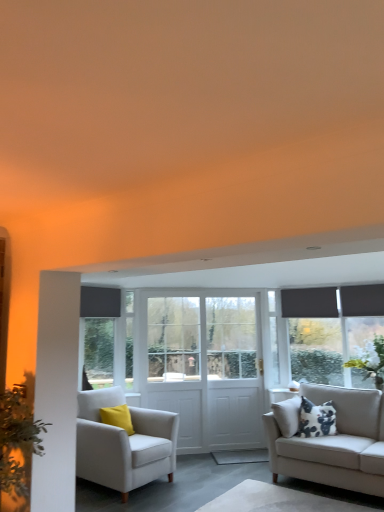
Question: Does white wooden door at center, which is the first screen door in right-to-left order, have a smaller size compared to white wooden screen door at center, acting as the 1th screen door starting from the left?

Choices:
 (A) no
 (B) yes

Answer: (B)

Question: From the image's perspective, is white wooden door at center, which is counted as the second screen door, starting from the left, below white wooden screen door at center, acting as the 1th screen door starting from the left?

Choices:
 (A) no
 (B) yes

Answer: (A)

Question: From the image's perspective, is white wooden door at center, which is the first screen door in right-to-left order, on white wooden screen door at center, acting as the 1th screen door starting from the left?

Choices:
 (A) yes
 (B) no

Answer: (A)

Question: Is white wooden screen door at center, acting as the 1th screen door starting from the left, inside white wooden door at center, which is the first screen door in right-to-left order?

Choices:
 (A) yes
 (B) no

Answer: (B)

Question: Does white wooden door at center, which is the first screen door in right-to-left order, have a larger size compared to white wooden screen door at center, acting as the 1th screen door starting from the left?

Choices:
 (A) yes
 (B) no

Answer: (B)

Question: From a real-world perspective, relative to white fabric armchair at left, is beige fabric couch at right vertically above or below?

Choices:
 (A) above
 (B) below

Answer: (A)

Question: Is beige fabric couch at right in front of or behind white fabric armchair at left in the image?

Choices:
 (A) front
 (B) behind

Answer: (A)

Question: Is beige fabric couch at right inside the boundaries of white fabric armchair at left, or outside?

Choices:
 (A) inside
 (B) outside

Answer: (B)

Question: Looking at their shapes, would you say beige fabric couch at right is wider or thinner than white fabric armchair at left?

Choices:
 (A) thin
 (B) wide

Answer: (A)

Question: From a real-world perspective, is white fabric armchair at left positioned above or below white textured plant at right, the 1th plant from the right?

Choices:
 (A) below
 (B) above

Answer: (A)

Question: Is point (127, 439) closer or farther from the camera than point (377, 354)?

Choices:
 (A) closer
 (B) farther

Answer: (A)

Question: Looking at their shapes, would you say white fabric armchair at left is wider or thinner than white textured plant at right, arranged as the 2th plant when viewed from the front?

Choices:
 (A) wide
 (B) thin

Answer: (A)

Question: Considering their positions, is white fabric armchair at left located in front of or behind white textured plant at right, arranged as the 2th plant when viewed from the front?

Choices:
 (A) front
 (B) behind

Answer: (A)

Question: Is white textured plant at right, arranged as the 2th plant when viewed from the front, taller or shorter than dark gray roller blind at left?

Choices:
 (A) tall
 (B) short

Answer: (B)

Question: Would you say white textured plant at right, arranged as the 2th plant when viewed from the front, is to the left or to the right of dark gray roller blind at left in the picture?

Choices:
 (A) right
 (B) left

Answer: (A)